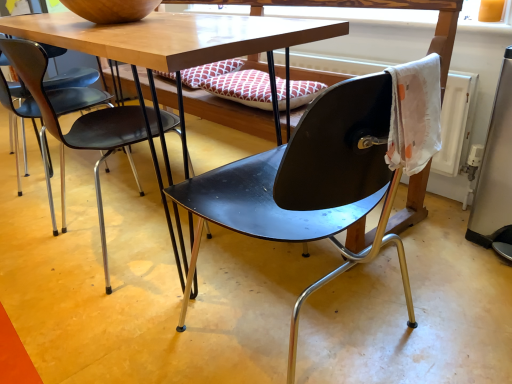
In order to click on free spot to the left of matte black chair at center, which is counted as the first chair, starting from the right in this screenshot , I will do `click(120, 338)`.